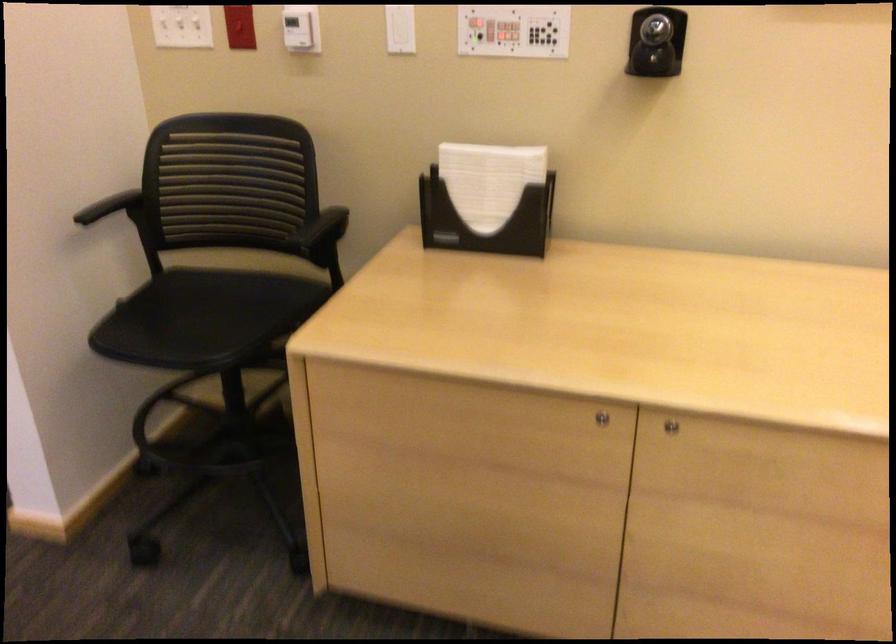
What are the coordinates of `control panel button` in the screenshot? It's located at (513, 31).